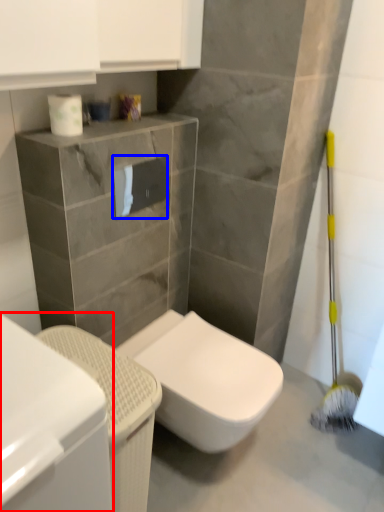
Question: Which object appears closest to the camera in this image, cabinetry (highlighted by a red box) or toilet paper (highlighted by a blue box)?

Choices:
 (A) cabinetry
 (B) toilet paper

Answer: (A)